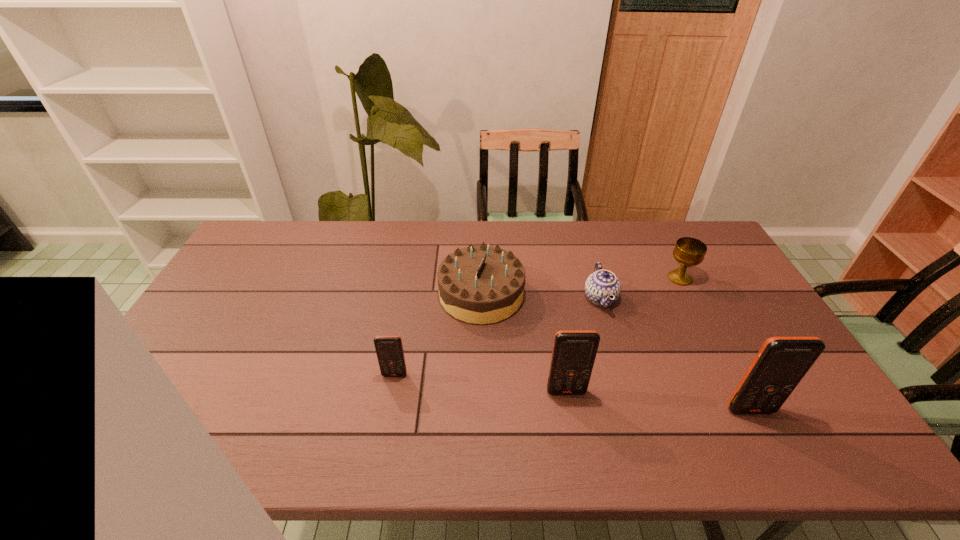
This screenshot has height=540, width=960. In order to click on vacant space situated on the screen of the third nearest object in this screenshot , I will do `click(391, 397)`.

At what (x,y) coordinates should I click in order to perform the action: click on free space located 0.060m on the screen of the fifth farthest object. Please return your answer as a coordinate pair (x, y). This screenshot has height=540, width=960. Looking at the image, I should click on (570, 417).

Where is `vacant space located on the front of the chalice`? This screenshot has height=540, width=960. vacant space located on the front of the chalice is located at coordinates click(x=711, y=339).

I want to click on free space located 0.280m on the front-facing side of the birthday cake, so click(x=350, y=294).

Identify the location of vacant space situated on the front-facing side of the birthday cake. (323, 294).

Locate an element on the screen. This screenshot has width=960, height=540. free point located on the front-facing side of the birthday cake is located at coordinates (353, 294).

Identify the location of free space located at the spout of the chinaware. This screenshot has width=960, height=540. (456, 298).

You are a GUI agent. You are given a task and a screenshot of the screen. Output one action in this format:
    pyautogui.click(x=<x>, y=<y>)
    Task: Click on the free space located at the spout of the chinaware
    
    Given the screenshot: What is the action you would take?
    pyautogui.click(x=552, y=298)

At what (x,y) coordinates should I click in order to perform the action: click on vacant region located 0.090m at the spout of the chinaware. Please return your answer as a coordinate pair (x, y). Looking at the image, I should click on pyautogui.click(x=555, y=298).

Where is `cellular telephone that is at the right edge`? This screenshot has height=540, width=960. cellular telephone that is at the right edge is located at coordinates (781, 363).